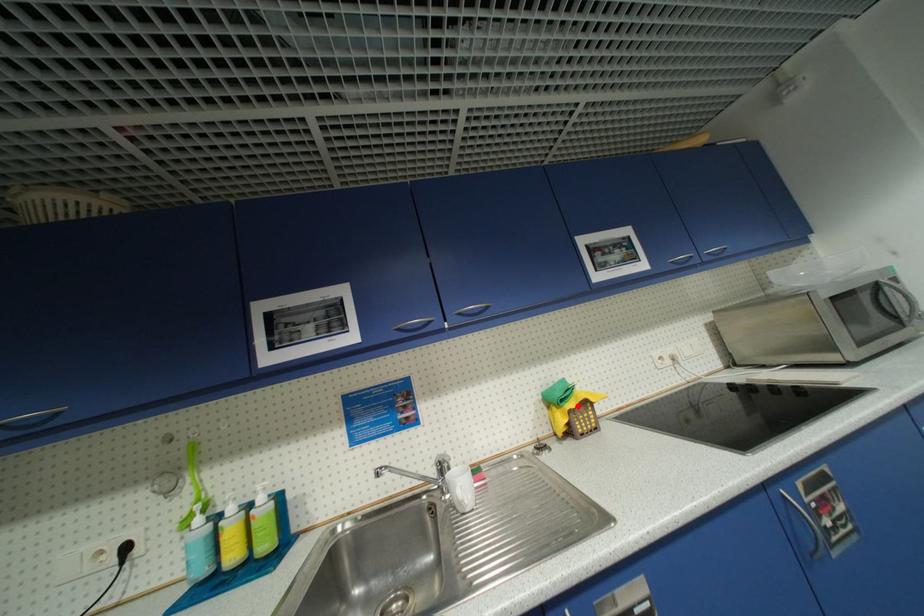
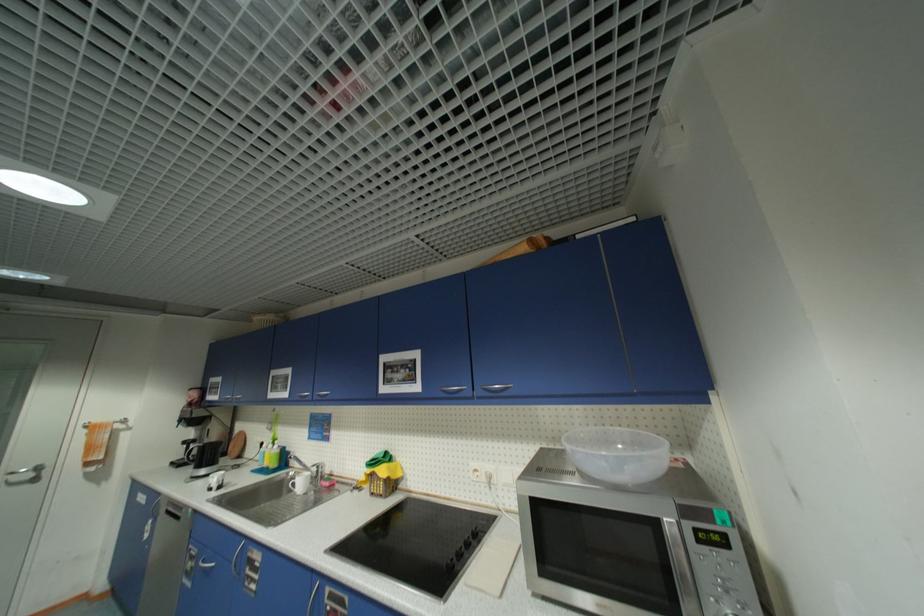
Locate, in the second image, the point that corresponds to the highlighted location in the first image.

(374, 472)